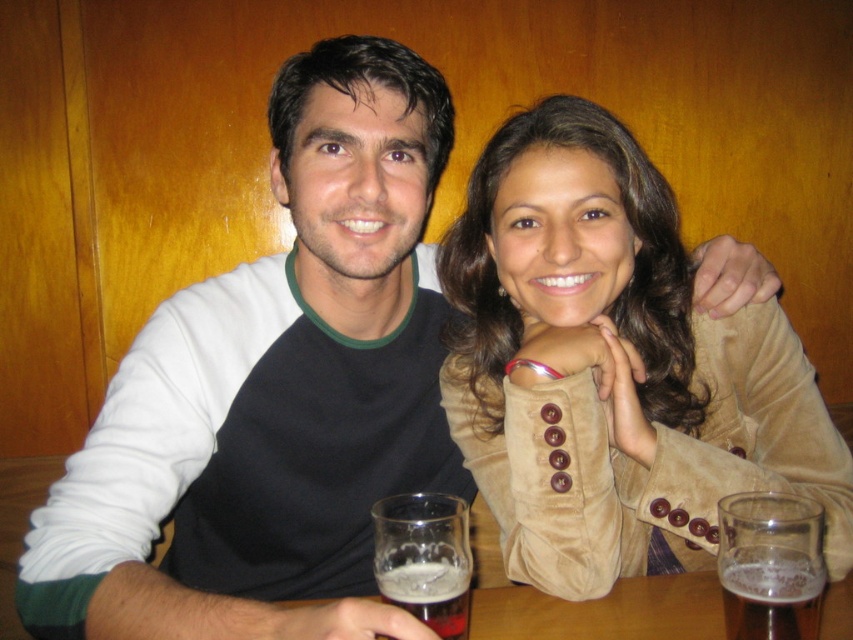
Question: Can you confirm if clear glass beer at lower center is positioned below translucent glass at lower center?

Choices:
 (A) no
 (B) yes

Answer: (A)

Question: Which point is closer to the camera?

Choices:
 (A) foamy amber liquid at lower center
 (B) suede jacket at center
 (C) clear glass beer at lower center

Answer: (A)

Question: Which point is farther to the camera?

Choices:
 (A) (795, 621)
 (B) (670, 516)
 (C) (805, 588)
 (D) (436, 621)

Answer: (B)

Question: Among these points, which one is farthest from the camera?

Choices:
 (A) (581, 563)
 (B) (759, 561)

Answer: (A)

Question: Does foamy amber liquid at lower right lie in front of foamy amber liquid at lower center?

Choices:
 (A) no
 (B) yes

Answer: (A)

Question: Can you confirm if clear glass beer at lower center is positioned above foamy amber liquid at lower right?

Choices:
 (A) no
 (B) yes

Answer: (B)